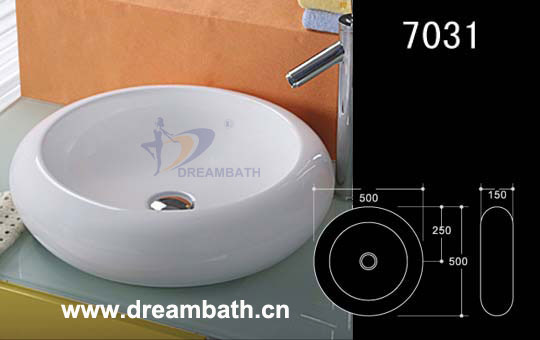
You are a GUI agent. You are given a task and a screenshot of the screen. Output one action in this format:
    pyautogui.click(x=<x>, y=<y>)
    Task: Click on the sink
    The image size is (540, 340).
    Given the screenshot: What is the action you would take?
    pyautogui.click(x=229, y=171)